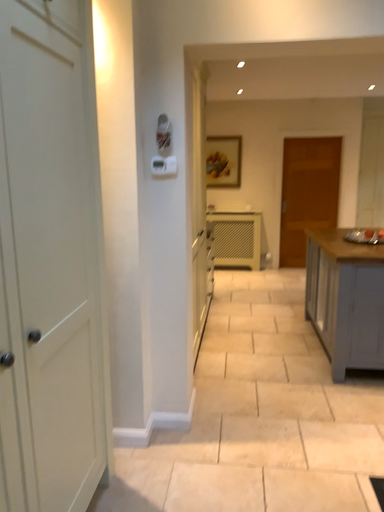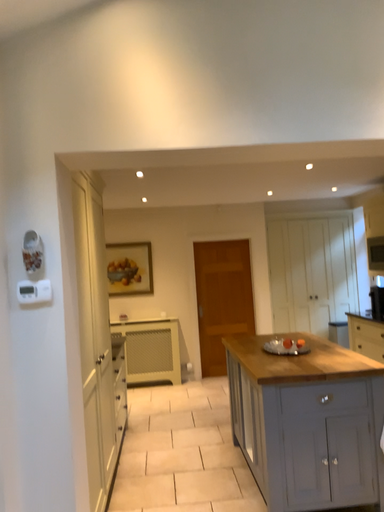
Question: Which way did the camera rotate in the video?

Choices:
 (A) rotated right
 (B) rotated left

Answer: (A)